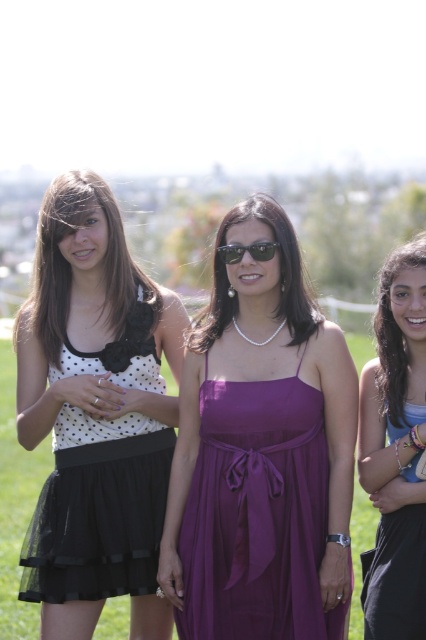
You are a photographer planning to take a group photo of the matte purple dress at center and sunglasses at center. The camera you have can only focus on objects within a 1.5 meter range. Will both subjects be in focus if they stay 1.74 meters apart?

The matte purple dress at center and sunglasses at center are 1.74 meters apart, which exceeds the camera focus range of 1.5 meters. Therefore, both subjects cannot be in focus simultaneously.